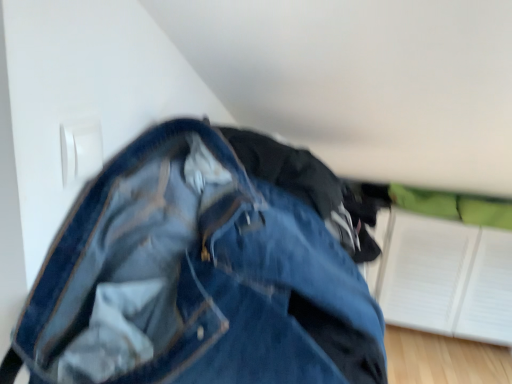
Image resolution: width=512 pixels, height=384 pixels. What do you see at coordinates (200, 274) in the screenshot?
I see `denim at center` at bounding box center [200, 274].

Find the location of a particular element. This screenshot has height=384, width=512. denim at center is located at coordinates (200, 274).

What is the approximate width of denim at center?

23.49 inches.

At what (x,y) coordinates should I click in order to perform the action: click on denim at center. Please return your answer as a coordinate pair (x, y). The width and height of the screenshot is (512, 384). Looking at the image, I should click on (200, 274).